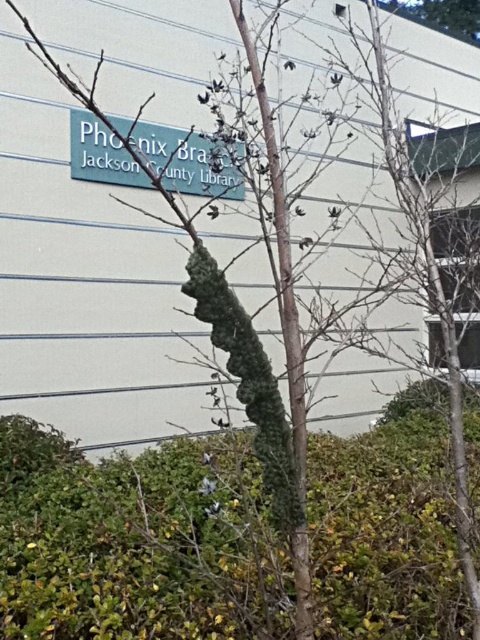
You are a maintenance worker who needs to place a 2.5 meter ladder between the green leafy hedge at center and the teal matte sign at upper center. Can the ladder fit between them without touching either object?

The distance between the green leafy hedge at center and the teal matte sign at upper center is 1.92 meters. Since the ladder is 2.5 meters long, it cannot fit between them without overlapping the space occupied by the hedge or the sign.

You are a delivery person approaching the Phoenix Branch Jackson County Library. You see the green leafy hedge at center and the teal matte sign at upper center. Which object is positioned higher up in the image?

The teal matte sign at upper center is positioned higher up in the image than the green leafy hedge at center.

You are a landscape architect designing a garden layout. You need to place a new statue that requires a base area of 1.2 square meters. Given the space occupied by the green leafy hedge at center and the teal matte sign at upper center, which object would allow enough space for the statue?

The green leafy hedge at center is larger in size than the teal matte sign at upper center, so the space around the green leafy hedge at center would likely provide more room for the statue requiring 1.2 square meters.